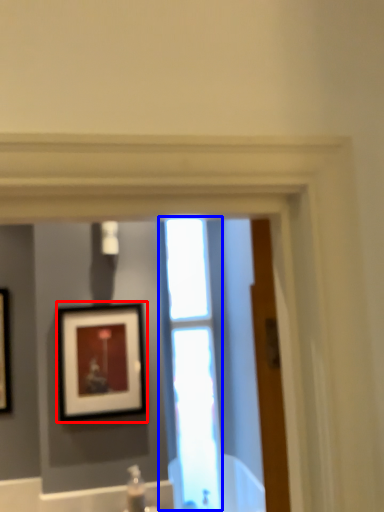
Question: Which object is further to the camera taking this photo, picture frame (highlighted by a red box) or window (highlighted by a blue box)?

Choices:
 (A) picture frame
 (B) window

Answer: (B)